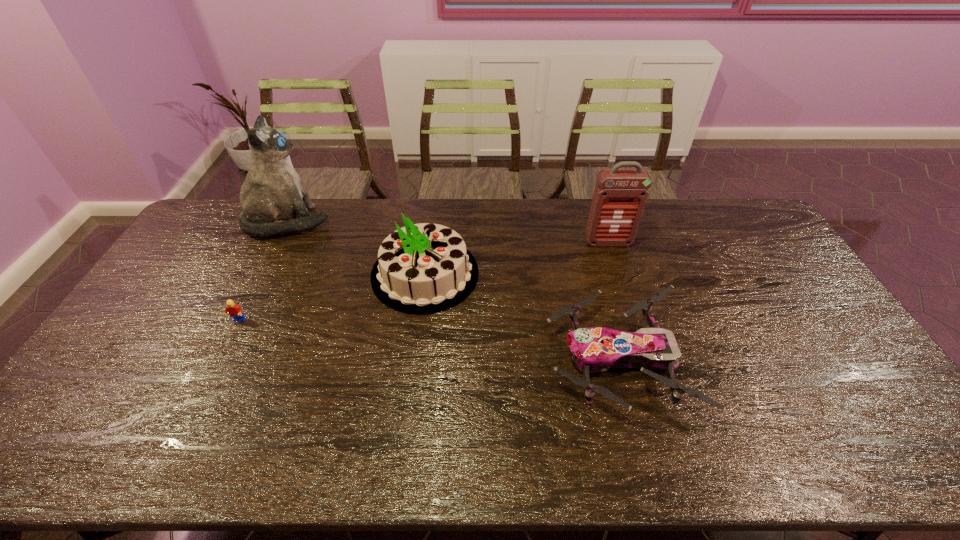
Choose which object is the fourth nearest neighbor to the cat. Please provide its 2D coordinates. Your answer should be formatted as a tuple, i.e. [(x, y)], where the tuple contains the x and y coordinates of a point satisfying the conditions above.

[(620, 195)]

This screenshot has width=960, height=540. I want to click on vacant space that satisfies the following two spatial constraints: 1. on the back side of the birthday cake; 2. at the face of the cat, so click(x=432, y=222).

Locate an element on the screen. The image size is (960, 540). free space that satisfies the following two spatial constraints: 1. at the face of the third object from right to left; 2. on the right side of the cat is located at coordinates (262, 274).

This screenshot has width=960, height=540. What are the coordinates of `vacant space that satisfies the following two spatial constraints: 1. on the back side of the third tallest object; 2. at the face of the cat` in the screenshot? It's located at point(432,222).

This screenshot has height=540, width=960. What are the coordinates of `vacant space that satisfies the following two spatial constraints: 1. at the face of the cat; 2. on the right side of the birthday cake` in the screenshot? It's located at (262, 274).